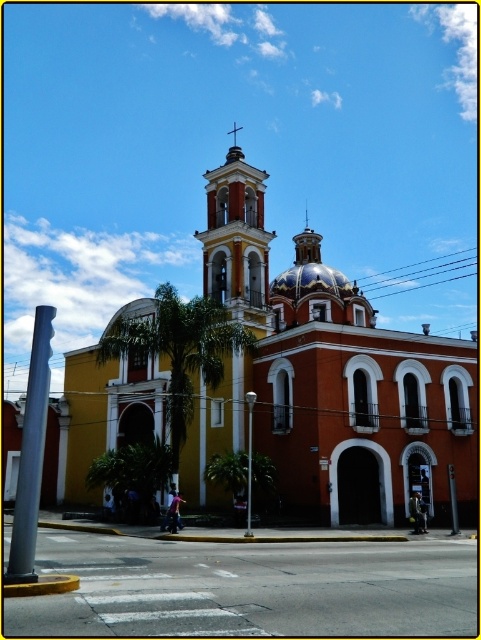
Question: Does orange stucco church at center have a lesser width compared to matte orange bell tower at center?

Choices:
 (A) no
 (B) yes

Answer: (A)

Question: Is orange stucco church at center positioned before matte orange bell tower at center?

Choices:
 (A) no
 (B) yes

Answer: (B)

Question: Which point appears farthest from the camera in this image?

Choices:
 (A) (258, 173)
 (B) (361, 432)

Answer: (A)

Question: Considering the relative positions of orange stucco church at center and matte orange bell tower at center in the image provided, where is orange stucco church at center located with respect to matte orange bell tower at center?

Choices:
 (A) above
 (B) below

Answer: (B)

Question: Among these points, which one is farthest from the camera?

Choices:
 (A) (111, 371)
 (B) (227, 269)

Answer: (A)